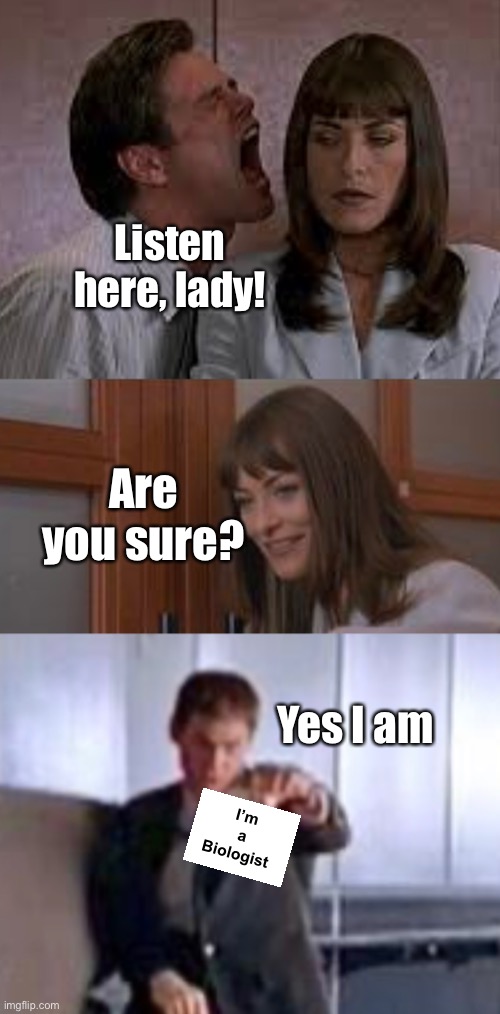
This screenshot has height=1014, width=500. What are the coordinates of `wooden frame` in the screenshot? It's located at (65, 438).